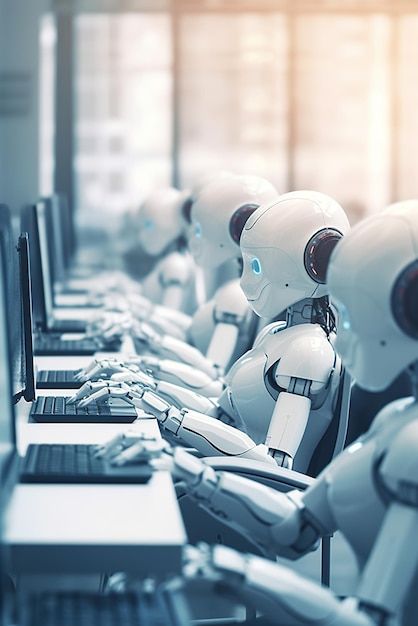
This screenshot has width=418, height=626. Find the location of `computer screens`. computer screens is located at coordinates (28, 300), (8, 389), (39, 275), (53, 245), (64, 228).